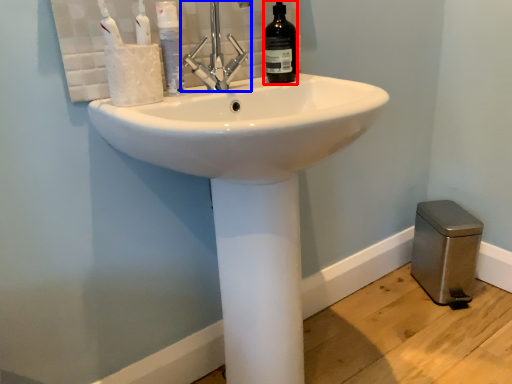
Question: Among these objects, which one is nearest to the camera, bottle (highlighted by a red box) or tap (highlighted by a blue box)?

Choices:
 (A) bottle
 (B) tap

Answer: (B)